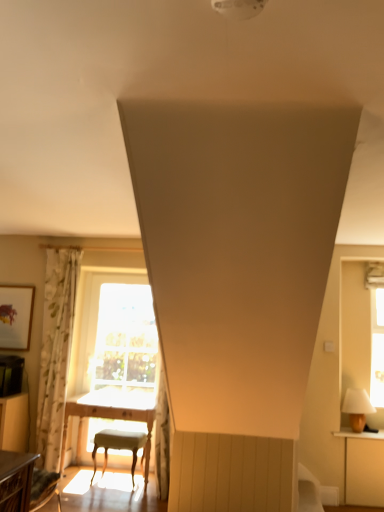
Question: Is point tap(18, 322) closer or farther from the camera than point tap(350, 388)?

Choices:
 (A) farther
 (B) closer

Answer: (A)

Question: Looking at their shapes, would you say matte wooden picture frame at upper left is wider or thinner than matte white lampshade at right?

Choices:
 (A) thin
 (B) wide

Answer: (A)

Question: Considering the real-world distances, which object is closest to the matte white lampshade at right?

Choices:
 (A) floral fabric curtain at left
 (B) matte wooden picture frame at upper left
 (C) wooden table at lower left, which is the second table from bottom to top
 (D) light wood table at center, the 2th table from the front
 (E) light gray fabric stool at center

Answer: (D)

Question: Which is nearer to the matte wooden picture frame at upper left?

Choices:
 (A) floral fabric curtain at left
 (B) light gray fabric stool at center
 (C) matte white lampshade at right
 (D) wooden table at lower left, which is the 1th table from top to bottom
 (E) light wood table at center, the first table in the back-to-front sequence

Answer: (A)